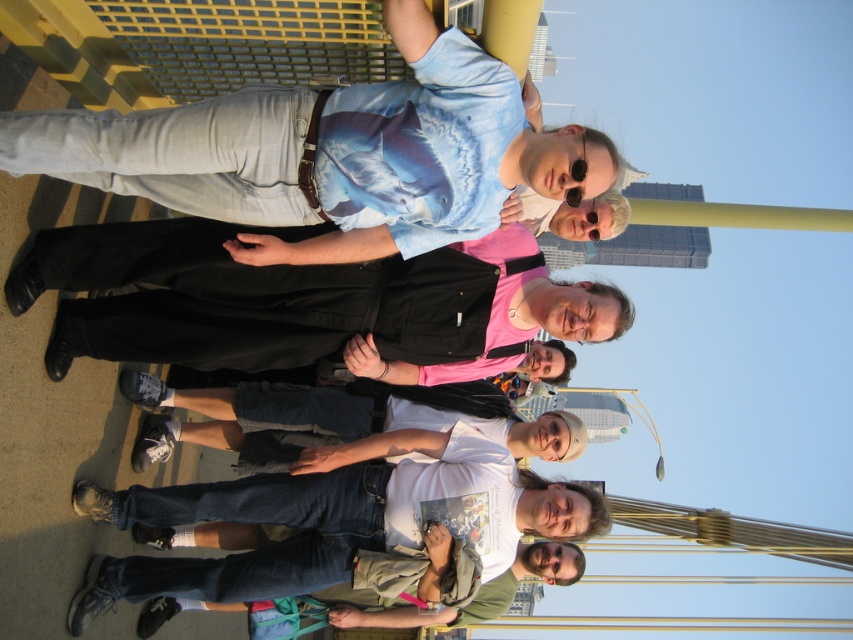
Does point (364, 88) come farther from viewer compared to point (531, 328)?

No, it is not.

Which is behind, point (567, 129) or point (434, 273)?

Positioned behind is point (434, 273).

Identify the location of shark print t-shirt at upper center. The image size is (853, 640). (332, 154).